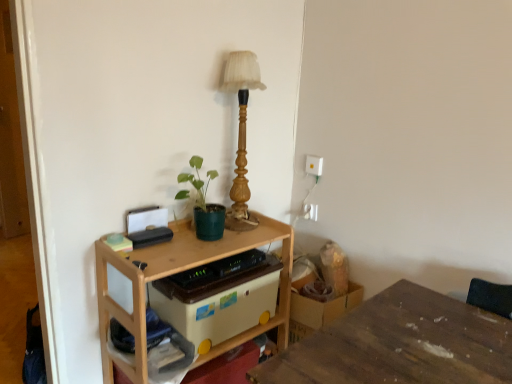
Identify the location of empty space that is ontop of beige plastic storage box at center (from a real-world perspective). (221, 277).